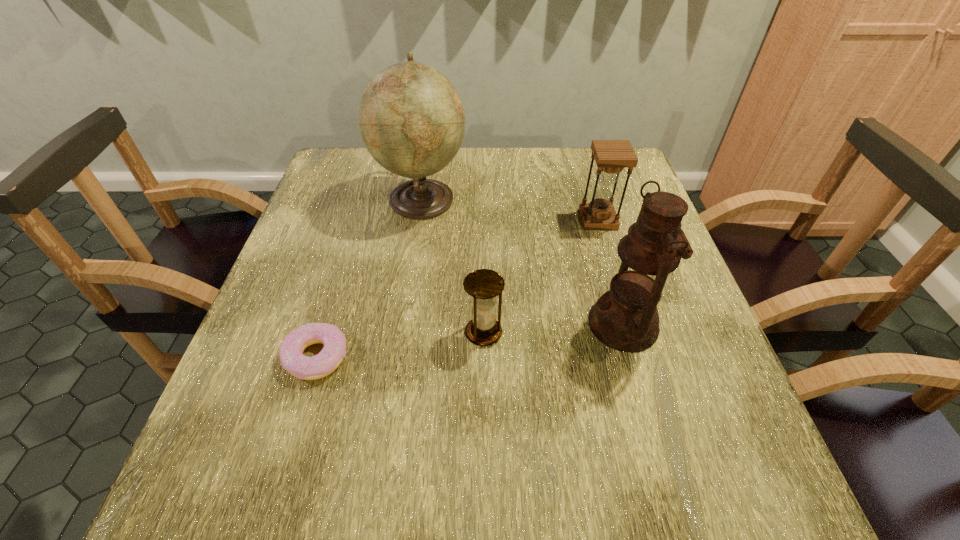
Where is `vacant area situated 0.160m on the right of the third object from right to left`? vacant area situated 0.160m on the right of the third object from right to left is located at coordinates (585, 333).

I want to click on vacant space located on the front of the doughnut, so click(x=281, y=471).

Locate an element on the screen. Image resolution: width=960 pixels, height=540 pixels. object located at the far edge is located at coordinates (411, 118).

This screenshot has height=540, width=960. What are the coordinates of `object located at the left edge` in the screenshot? It's located at (292, 359).

Locate an element on the screen. This screenshot has width=960, height=540. oil lamp situated at the right edge is located at coordinates (625, 318).

I want to click on hourglass located in the right edge section of the desktop, so point(611,156).

In the image, there is a desktop. Where is `vacant space at the near edge`? The height and width of the screenshot is (540, 960). vacant space at the near edge is located at coordinates (534, 467).

Where is `vacant space at the left edge of the desktop`? This screenshot has width=960, height=540. vacant space at the left edge of the desktop is located at coordinates (269, 306).

Find the location of a particular element. The image size is (960, 540). blank space at the right edge is located at coordinates (733, 410).

In the image, there is a desktop. What are the coordinates of `vacant space at the far left corner` in the screenshot? It's located at (346, 151).